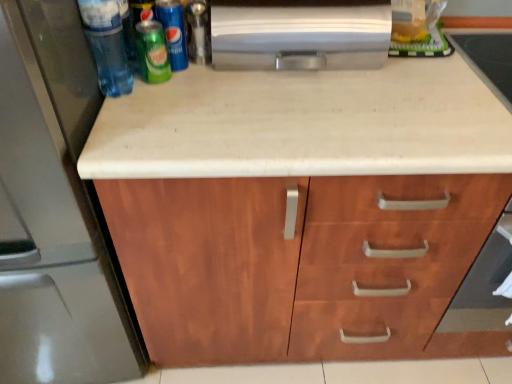
Locate an element on the screen. The image size is (512, 384). spots to the right of silver metallic paper towel holder at upper center is located at coordinates (454, 76).